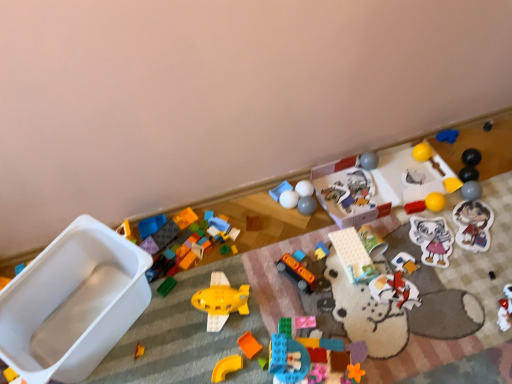
Where is `vacant area that is in front of matte gray ball at right, which appears as the 24th toy when viewed from the left`? vacant area that is in front of matte gray ball at right, which appears as the 24th toy when viewed from the left is located at coordinates (476, 233).